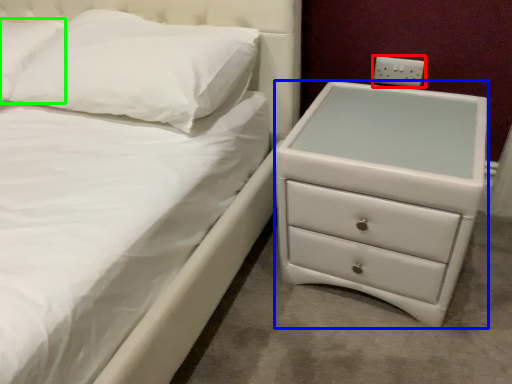
Question: Which object is positioned farthest from electric outlet (highlighted by a red box)? Select from chest of drawers (highlighted by a blue box) and pillow (highlighted by a green box).

Choices:
 (A) chest of drawers
 (B) pillow

Answer: (B)